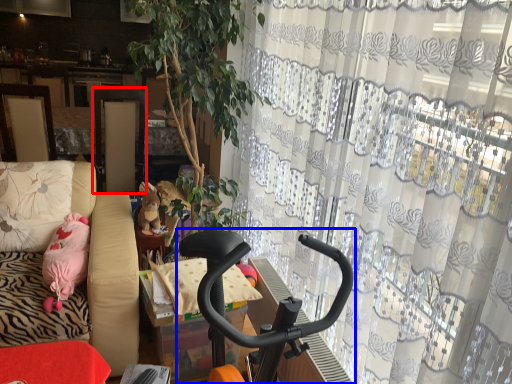
Question: Among these objects, which one is farthest to the camera, screen door (highlighted by a red box) or baby carriage (highlighted by a blue box)?

Choices:
 (A) screen door
 (B) baby carriage

Answer: (A)